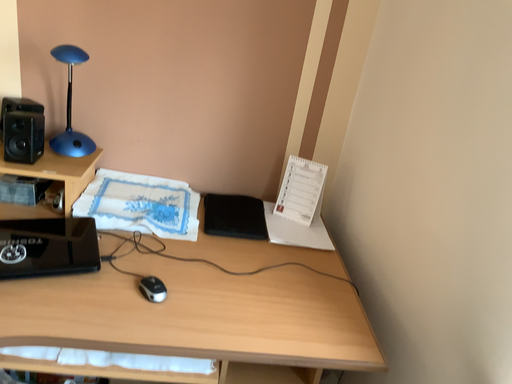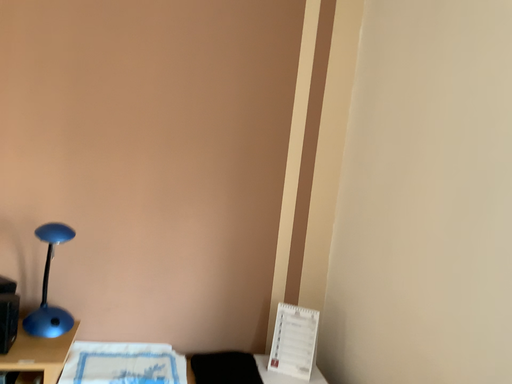
Question: Which way did the camera rotate in the video?

Choices:
 (A) rotated downward
 (B) rotated upward

Answer: (B)